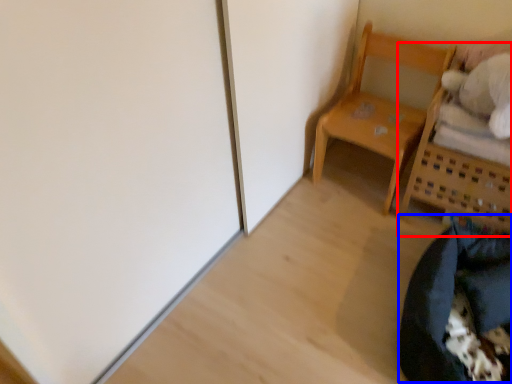
Question: Which point is closer to the camera, furniture (highlighted by a red box) or bean bag chair (highlighted by a blue box)?

Choices:
 (A) furniture
 (B) bean bag chair

Answer: (B)